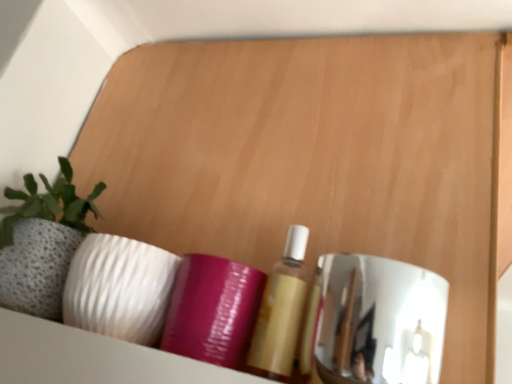
Question: Which direction should I rotate to look at matte gold bottle at center, positioned as the first toiletry in right-to-left order?

Choices:
 (A) left
 (B) right

Answer: (B)

Question: Is purple glossy tube at center, the second toiletry when ordered from right to left, bigger than polished chrome mirror at right?

Choices:
 (A) no
 (B) yes

Answer: (A)

Question: Is purple glossy tube at center, positioned as the 1th toiletry in left-to-right order, far from polished chrome mirror at right?

Choices:
 (A) yes
 (B) no

Answer: (B)

Question: From the image's perspective, is purple glossy tube at center, the second toiletry when ordered from right to left, under polished chrome mirror at right?

Choices:
 (A) yes
 (B) no

Answer: (B)

Question: Is purple glossy tube at center, the second toiletry when ordered from right to left, turned away from polished chrome mirror at right?

Choices:
 (A) no
 (B) yes

Answer: (A)

Question: Does purple glossy tube at center, positioned as the 1th toiletry in left-to-right order, have a greater width compared to polished chrome mirror at right?

Choices:
 (A) no
 (B) yes

Answer: (A)

Question: Does purple glossy tube at center, positioned as the 1th toiletry in left-to-right order, come in front of polished chrome mirror at right?

Choices:
 (A) no
 (B) yes

Answer: (A)

Question: From a real-world perspective, is polished chrome mirror at right located beneath purple glossy tube at center, positioned as the 1th toiletry in left-to-right order?

Choices:
 (A) no
 (B) yes

Answer: (A)

Question: Is polished chrome mirror at right positioned behind purple glossy tube at center, the second toiletry when ordered from right to left?

Choices:
 (A) yes
 (B) no

Answer: (B)

Question: Is polished chrome mirror at right taller than purple glossy tube at center, positioned as the 1th toiletry in left-to-right order?

Choices:
 (A) no
 (B) yes

Answer: (B)

Question: Does polished chrome mirror at right have a lesser height compared to purple glossy tube at center, the second toiletry when ordered from right to left?

Choices:
 (A) no
 (B) yes

Answer: (A)

Question: Is polished chrome mirror at right positioned with its back to purple glossy tube at center, the second toiletry when ordered from right to left?

Choices:
 (A) yes
 (B) no

Answer: (A)

Question: Is polished chrome mirror at right at the right side of purple glossy tube at center, positioned as the 1th toiletry in left-to-right order?

Choices:
 (A) no
 (B) yes

Answer: (B)

Question: Is matte gold bottle at center, marked as the second toiletry in a left-to-right arrangement, shorter than purple glossy tube at center, the second toiletry when ordered from right to left?

Choices:
 (A) no
 (B) yes

Answer: (A)